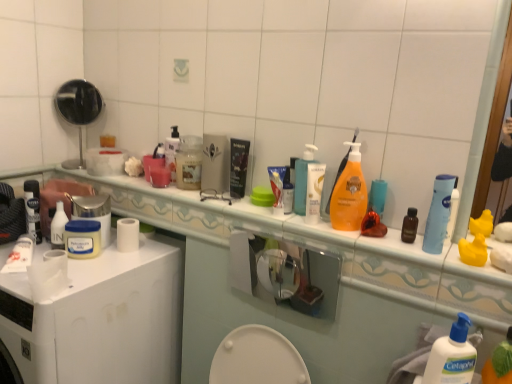
Identify the location of vacant space situated on the left part of matte black tube at center. (193, 196).